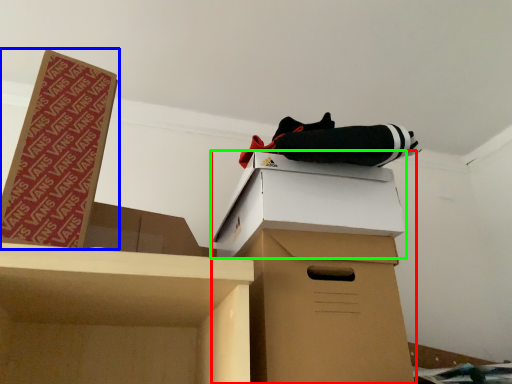
Question: Which object is the farthest from cardboard box (highlighted by a red box)? Choose among these: box (highlighted by a blue box) or box (highlighted by a green box).

Choices:
 (A) box
 (B) box

Answer: (A)